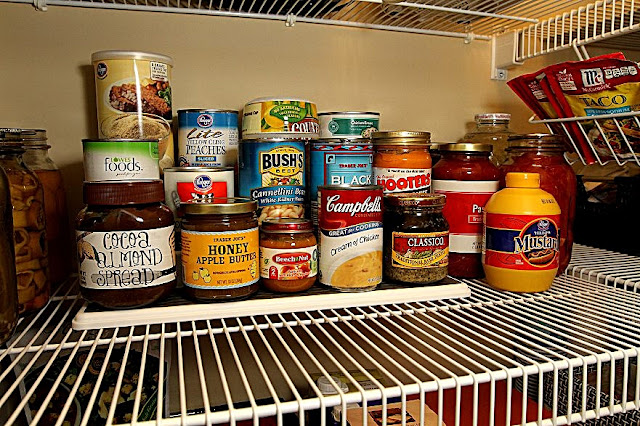
Find the location of `glass jar`. glass jar is located at coordinates (125, 233), (212, 259), (292, 262), (420, 241), (466, 176), (547, 168), (493, 141), (413, 165), (48, 176), (29, 196).